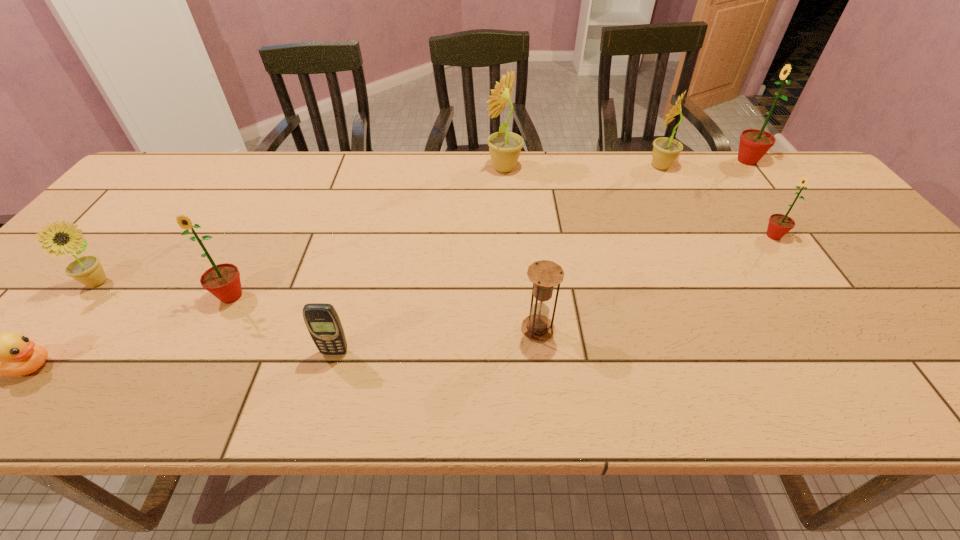
The height and width of the screenshot is (540, 960). Find the location of `free space located on the back of the hourglass`. free space located on the back of the hourglass is located at coordinates (528, 246).

Image resolution: width=960 pixels, height=540 pixels. In order to click on vacant region located 0.100m on the screen of the sixth object from right to left in this screenshot , I will do `click(322, 400)`.

Locate an element on the screen. This screenshot has height=540, width=960. object that is positioned at the left edge is located at coordinates (87, 270).

At what (x,y) coordinates should I click in order to perform the action: click on object that is at the right edge. Please return your answer as a coordinate pair (x, y). The width and height of the screenshot is (960, 540). Looking at the image, I should click on (754, 144).

Identify the location of object situated at the far right corner. This screenshot has width=960, height=540. (754, 144).

This screenshot has height=540, width=960. I want to click on vacant space at the far edge, so click(x=360, y=192).

In the image, there is a desktop. Where is `vacant region at the left edge`? vacant region at the left edge is located at coordinates (59, 325).

Identify the location of free region at the right edge. The image size is (960, 540). (804, 197).

You are a GUI agent. You are given a task and a screenshot of the screen. Output one action in this format:
    pyautogui.click(x=<x>, y=<y>)
    Task: Click on the vacant space at the far left corner
    This screenshot has height=540, width=960.
    Given the screenshot: What is the action you would take?
    click(147, 193)

What are the coordinates of `free space at the near right corner` in the screenshot? It's located at (959, 375).